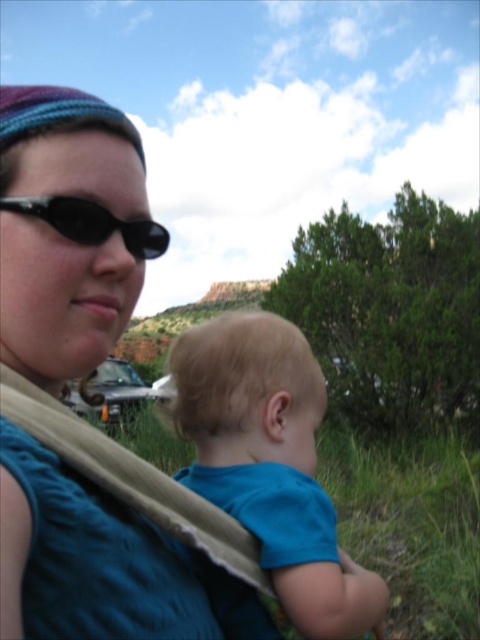
Can you confirm if blue knitted hat at upper left is bigger than black matte sunglasses at upper left?

Indeed, blue knitted hat at upper left has a larger size compared to black matte sunglasses at upper left.

Who is lower down, blue knitted hat at upper left or black matte sunglasses at upper left?

blue knitted hat at upper left

Does point (3, 140) come in front of point (158, 234)?

Yes, it is in front of point (158, 234).

The image size is (480, 640). Find the location of `blue knitted hat at upper left`. blue knitted hat at upper left is located at coordinates (69, 230).

Describe the element at coordinates (69, 230) in the screenshot. I see `blue knitted hat at upper left` at that location.

Is point (72, 176) positioned behind point (319, 500)?

Yes, it is.

At what (x,y) coordinates should I click in order to perform the action: click on blue knitted hat at upper left. Please return your answer as a coordinate pair (x, y). The image size is (480, 640). Looking at the image, I should click on (69, 230).

Does point (299, 404) lie in front of point (82, 230)?

No.

Which is in front, point (288, 468) or point (123, 227)?

Point (288, 468) is more forward.

Measure the distance between point (237, 451) and camera.

147.09 feet

Where is `blue soft fabric toddler at center`? This screenshot has height=640, width=480. blue soft fabric toddler at center is located at coordinates (271, 464).